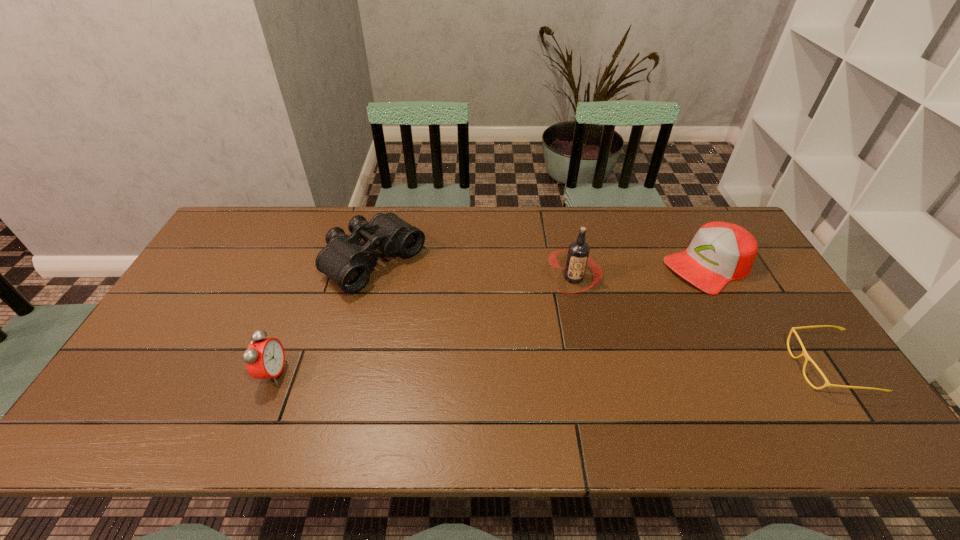
Find the location of `free space located 0.090m on the label of the third object from left to right`. free space located 0.090m on the label of the third object from left to right is located at coordinates (564, 319).

Locate an element on the screen. blank space located on the label of the third object from left to right is located at coordinates (563, 324).

Where is `vacant space situated on the label of the third object from left to right`? The image size is (960, 540). vacant space situated on the label of the third object from left to right is located at coordinates (562, 329).

Find the location of a particular element. This screenshot has height=540, width=960. vacant space located at the eyepieces of the binoculars is located at coordinates (447, 316).

Where is `vacant area located 0.110m at the eyepieces of the binoculars`? Image resolution: width=960 pixels, height=540 pixels. vacant area located 0.110m at the eyepieces of the binoculars is located at coordinates (433, 306).

The width and height of the screenshot is (960, 540). I want to click on free space located at the eyepieces of the binoculars, so click(x=425, y=301).

At what (x,y) coordinates should I click in order to perform the action: click on blank space located on the front-facing side of the baseball cap. Please return your answer as a coordinate pair (x, y). The image size is (960, 540). Looking at the image, I should click on (598, 328).

Find the location of a particular element. The width and height of the screenshot is (960, 540). vacant space located 0.060m on the front-facing side of the baseball cap is located at coordinates (665, 289).

At what (x,y) coordinates should I click in order to perform the action: click on vacant space positioned on the front-facing side of the baseball cap. Please return your answer as a coordinate pair (x, y). The height and width of the screenshot is (540, 960). Looking at the image, I should click on (624, 313).

Locate an element on the screen. The height and width of the screenshot is (540, 960). binoculars at the far edge is located at coordinates (344, 260).